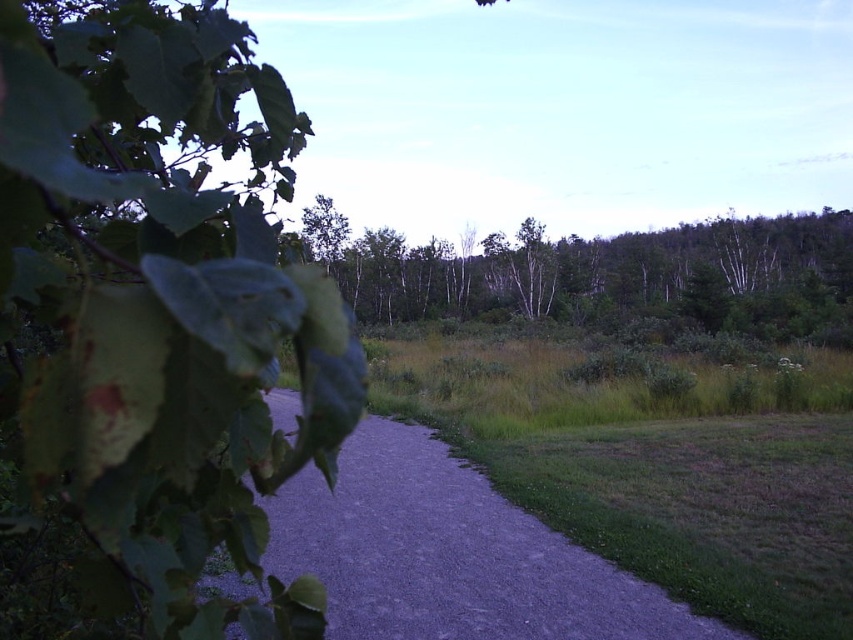
The width and height of the screenshot is (853, 640). What are the coordinates of `green matte trees at upper center` in the screenshot? It's located at (602, 273).

Does green matte trees at upper center lie behind green grass at center?

No.

What do you see at coordinates (602, 273) in the screenshot?
I see `green matte trees at upper center` at bounding box center [602, 273].

Identify the location of green matte trees at upper center. (602, 273).

Is green leafy tree at left below gray gravel path at center?

No.

Is point (32, 442) positioned after point (635, 634)?

No, it is in front of (635, 634).

Who is more distant from viewer, (254, 125) or (474, 625)?

Point (474, 625)

Where is `green leafy tree at left`? This screenshot has height=640, width=853. green leafy tree at left is located at coordinates (158, 308).

In the scene shown: Does green leafy tree at left appear over green grass at center?

Yes, green leafy tree at left is above green grass at center.

Between point (96, 368) and point (582, 342), which one is positioned in front?

Positioned in front is point (96, 368).

Where is `green leafy tree at left`? This screenshot has height=640, width=853. green leafy tree at left is located at coordinates (158, 308).